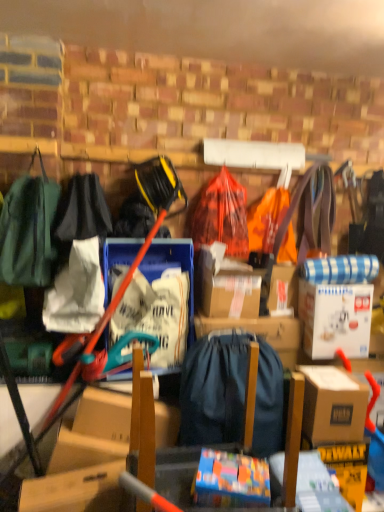
What is the approximate height of white fabric bag at center, which is counted as the 3th clothing, starting from the right?

The height of white fabric bag at center, which is counted as the 3th clothing, starting from the right, is 15.99 inches.

The width and height of the screenshot is (384, 512). What do you see at coordinates (160, 302) in the screenshot? I see `white plastic bag at center, which is the second storage box in right-to-left order` at bounding box center [160, 302].

Identify the location of blue fabric bag at center, which is counted as the first storage box, starting from the right. Image resolution: width=384 pixels, height=512 pixels. (260, 332).

Measure the distance between point (237, 182) and camera.

Point (237, 182) is 2.14 meters from camera.

The height and width of the screenshot is (512, 384). What are the coordinates of `plastic bag at center, which ranks as the 4th clothing in left-to-right order` in the screenshot? It's located at (222, 215).

Locate an element on the screen. brown cardboard box at right, marked as the 1th box in a front-to-back arrangement is located at coordinates (333, 405).

Considering their positions, is brown cardboard box at right, which appears as the 2th box when viewed from the top, located in front of or behind dark blue fabric backpack at center?

brown cardboard box at right, which appears as the 2th box when viewed from the top, is behind dark blue fabric backpack at center.

Is brown cardboard box at right, positioned as the 1th box in bottom-to-top order, at the left side of dark blue fabric backpack at center?

In fact, brown cardboard box at right, positioned as the 1th box in bottom-to-top order, is to the right of dark blue fabric backpack at center.

Which of these two, brown cardboard box at right, arranged as the 2th box when viewed from the back, or dark blue fabric backpack at center, is wider?

dark blue fabric backpack at center.

Do you think brown cardboard box at right, positioned as the 1th box in bottom-to-top order, is within dark blue fabric backpack at center, or outside of it?

brown cardboard box at right, positioned as the 1th box in bottom-to-top order, is not enclosed by dark blue fabric backpack at center.

From a real-world perspective, who is located lower, green fabric backpack at left, which is the fourth clothing in right-to-left order, or white plastic bag at center, which is the second storage box in right-to-left order?

From a 3D spatial view, white plastic bag at center, which is the second storage box in right-to-left order, is below.

From the image's perspective, does green fabric backpack at left, which ranks as the 1th clothing in left-to-right order, appear lower than white plastic bag at center, the 1th storage box viewed from the left?

Actually, green fabric backpack at left, which ranks as the 1th clothing in left-to-right order, appears above white plastic bag at center, the 1th storage box viewed from the left, in the image.

Considering the positions of objects green fabric backpack at left, which is the fourth clothing in right-to-left order, and white plastic bag at center, the 1th storage box viewed from the left, in the image provided, who is more to the left, green fabric backpack at left, which is the fourth clothing in right-to-left order, or white plastic bag at center, the 1th storage box viewed from the left,?

green fabric backpack at left, which is the fourth clothing in right-to-left order, is more to the left.

Is green fabric backpack at left, which ranks as the 1th clothing in left-to-right order, positioned with its back to white plastic bag at center, which is the second storage box in right-to-left order?

No, white plastic bag at center, which is the second storage box in right-to-left order, is not at the back of green fabric backpack at left, which ranks as the 1th clothing in left-to-right order.

From a real-world perspective, which is physically above, black fabric bag at left, which is the 3th clothing in left-to-right order, or plastic bag at center, which ranks as the 4th clothing in left-to-right order?

→ black fabric bag at left, which is the 3th clothing in left-to-right order, is physically above.

Considering the relative sizes of black fabric bag at left, the second clothing viewed from the right, and plastic bag at center, which ranks as the 4th clothing in left-to-right order, in the image provided, is black fabric bag at left, the second clothing viewed from the right, wider than plastic bag at center, which ranks as the 4th clothing in left-to-right order,?

Yes.

How different are the orientations of black fabric bag at left, which is the 3th clothing in left-to-right order, and plastic bag at center, the first clothing positioned from the right, in degrees?

The angle between the facing direction of black fabric bag at left, which is the 3th clothing in left-to-right order, and the facing direction of plastic bag at center, the first clothing positioned from the right, is 2.37 degrees.

Between black fabric bag at left, the second clothing viewed from the right, and plastic bag at center, which ranks as the 4th clothing in left-to-right order, which one has larger size?

black fabric bag at left, the second clothing viewed from the right.

Would you consider green fabric backpack at left, which ranks as the 1th clothing in left-to-right order, to be distant from dark blue fabric backpack at center?

No, green fabric backpack at left, which ranks as the 1th clothing in left-to-right order, is in close proximity to dark blue fabric backpack at center.

Is point (18, 258) farther from viewer compared to point (263, 440)?

Yes.

Is green fabric backpack at left, which is the fourth clothing in right-to-left order, located outside dark blue fabric backpack at center?

Absolutely, green fabric backpack at left, which is the fourth clothing in right-to-left order, is external to dark blue fabric backpack at center.

Consider the image. From the image's perspective, is black fabric bag at left, which is the 3th clothing in left-to-right order, below white fabric bag at center, positioned as the 2th clothing in left-to-right order?

No, from the image's perspective, black fabric bag at left, which is the 3th clothing in left-to-right order, is not below white fabric bag at center, positioned as the 2th clothing in left-to-right order.

Would you say black fabric bag at left, which is the 3th clothing in left-to-right order, is inside or outside white fabric bag at center, positioned as the 2th clothing in left-to-right order?

black fabric bag at left, which is the 3th clothing in left-to-right order, exists outside the volume of white fabric bag at center, positioned as the 2th clothing in left-to-right order.

You are a GUI agent. You are given a task and a screenshot of the screen. Output one action in this format:
    pyautogui.click(x=<x>, y=<y>)
    Task: Click on the 1st clothing to the left of the black fabric bag at left, the second clothing viewed from the right, counting from the anchor's position
    
    Given the screenshot: What is the action you would take?
    pyautogui.click(x=76, y=291)

Is black fabric bag at left, which is the 3th clothing in left-to-right order, further to camera compared to white fabric bag at center, which is counted as the 3th clothing, starting from the right?

Yes, black fabric bag at left, which is the 3th clothing in left-to-right order, is behind white fabric bag at center, which is counted as the 3th clothing, starting from the right.

In the scene shown: Is white cardboard box at upper right, which is the first box from back to front, to the right of plastic bag at center, the first clothing positioned from the right, from the viewer's perspective?

Yes, white cardboard box at upper right, which is the first box from back to front, is to the right of plastic bag at center, the first clothing positioned from the right.

Does white cardboard box at upper right, which is the second box in front-to-back order, have a greater width compared to plastic bag at center, the first clothing positioned from the right?

Indeed, white cardboard box at upper right, which is the second box in front-to-back order, has a greater width compared to plastic bag at center, the first clothing positioned from the right.

Could you tell me if white cardboard box at upper right, which appears as the first box when viewed from the top, is turned towards plastic bag at center, the first clothing positioned from the right?

No, white cardboard box at upper right, which appears as the first box when viewed from the top, is not turned towards plastic bag at center, the first clothing positioned from the right.

Considering their positions, is white cardboard box at upper right, which appears as the first box when viewed from the top, located in front of or behind plastic bag at center, which ranks as the 4th clothing in left-to-right order?

white cardboard box at upper right, which appears as the first box when viewed from the top, is positioned closer to the viewer than plastic bag at center, which ranks as the 4th clothing in left-to-right order.

What's the angular difference between white fabric bag at center, positioned as the 2th clothing in left-to-right order, and white cardboard box at upper right, which is the first box from back to front,'s facing directions?

white fabric bag at center, positioned as the 2th clothing in left-to-right order, and white cardboard box at upper right, which is the first box from back to front, are facing 1 degrees away from each other.

Is white fabric bag at center, positioned as the 2th clothing in left-to-right order, positioned with its back to white cardboard box at upper right, which is the first box from back to front?

white fabric bag at center, positioned as the 2th clothing in left-to-right order, is not turned away from white cardboard box at upper right, which is the first box from back to front.

Based on their positions, is white fabric bag at center, positioned as the 2th clothing in left-to-right order, located to the left or right of white cardboard box at upper right, which appears as the first box when viewed from the top?

From the image, it's evident that white fabric bag at center, positioned as the 2th clothing in left-to-right order, is to the left of white cardboard box at upper right, which appears as the first box when viewed from the top.

Is white fabric bag at center, positioned as the 2th clothing in left-to-right order, shorter than white cardboard box at upper right, which is counted as the 2th box, starting from the bottom?

Incorrect, the height of white fabric bag at center, positioned as the 2th clothing in left-to-right order, does not fall short of that of white cardboard box at upper right, which is counted as the 2th box, starting from the bottom.

The height and width of the screenshot is (512, 384). I want to click on backpack located underneath the brown cardboard box at right, marked as the 1th box in a front-to-back arrangement (from a real-world perspective), so click(x=230, y=393).

From the image's perspective, which clothing is the 2nd one above the white plastic bag at center, the 1th storage box viewed from the left? Please provide its 2D coordinates.

[(29, 230)]

When comparing their distances from dark blue fabric backpack at center, does brown cardboard box at right, marked as the 1th box in a front-to-back arrangement, or white cardboard box at upper right, which is the second box in front-to-back order, seem closer?

The object closer to dark blue fabric backpack at center is brown cardboard box at right, marked as the 1th box in a front-to-back arrangement.

When comparing their distances from white cardboard box at upper right, which is the second box in front-to-back order, does black fabric bag at left, which is the 3th clothing in left-to-right order, or white fabric bag at center, which is counted as the 3th clothing, starting from the right, seem further?

Among the two, black fabric bag at left, which is the 3th clothing in left-to-right order, is located further to white cardboard box at upper right, which is the second box in front-to-back order.

When comparing their distances from green fabric backpack at left, which is the fourth clothing in right-to-left order, does plastic bag at center, the first clothing positioned from the right, or white fabric bag at center, which is counted as the 3th clothing, starting from the right, seem further?

plastic bag at center, the first clothing positioned from the right.

Estimate the real-world distances between objects in this image. Which object is closer to brown cardboard box at right, positioned as the 1th box in bottom-to-top order, white plastic bag at center, the 1th storage box viewed from the left, or white fabric bag at center, positioned as the 2th clothing in left-to-right order?

white plastic bag at center, the 1th storage box viewed from the left, is closer to brown cardboard box at right, positioned as the 1th box in bottom-to-top order.

Based on their spatial positions, is white fabric bag at center, which is counted as the 3th clothing, starting from the right, or green fabric backpack at left, which is the fourth clothing in right-to-left order, closer to blue fabric bag at center, which is counted as the first storage box, starting from the right?

white fabric bag at center, which is counted as the 3th clothing, starting from the right, lies closer to blue fabric bag at center, which is counted as the first storage box, starting from the right, than the other object.

Looking at the image, which one is located closer to plastic bag at center, the first clothing positioned from the right, white fabric bag at center, positioned as the 2th clothing in left-to-right order, or blue fabric bag at center, which is counted as the first storage box, starting from the right?

blue fabric bag at center, which is counted as the first storage box, starting from the right, lies closer to plastic bag at center, the first clothing positioned from the right, than the other object.

From the image, which object appears to be farther from dark blue fabric backpack at center, black fabric bag at left, which is the 3th clothing in left-to-right order, or green fabric backpack at left, which ranks as the 1th clothing in left-to-right order?

green fabric backpack at left, which ranks as the 1th clothing in left-to-right order, lies further to dark blue fabric backpack at center than the other object.

Based on their spatial positions, is white fabric bag at center, which is counted as the 3th clothing, starting from the right, or green fabric backpack at left, which is the fourth clothing in right-to-left order, further from white cardboard box at upper right, which is the first box from back to front?

Based on the image, green fabric backpack at left, which is the fourth clothing in right-to-left order, appears to be further to white cardboard box at upper right, which is the first box from back to front.

Find the location of a particular element. backpack between plastic bag at center, which ranks as the 4th clothing in left-to-right order, and brown cardboard box at right, positioned as the 1th box in bottom-to-top order, in the up-down direction is located at coordinates (230, 393).

This screenshot has height=512, width=384. I want to click on storage box between plastic bag at center, which ranks as the 4th clothing in left-to-right order, and blue fabric bag at center, acting as the second storage box starting from the left, in the vertical direction, so click(x=160, y=302).

Identify the location of storage box between white fabric bag at center, positioned as the 2th clothing in left-to-right order, and dark blue fabric backpack at center, in the horizontal direction. The width and height of the screenshot is (384, 512). (160, 302).

This screenshot has height=512, width=384. What are the coordinates of `box between plastic bag at center, the first clothing positioned from the right, and dark blue fabric backpack at center, in the vertical direction` in the screenshot? It's located at (335, 319).